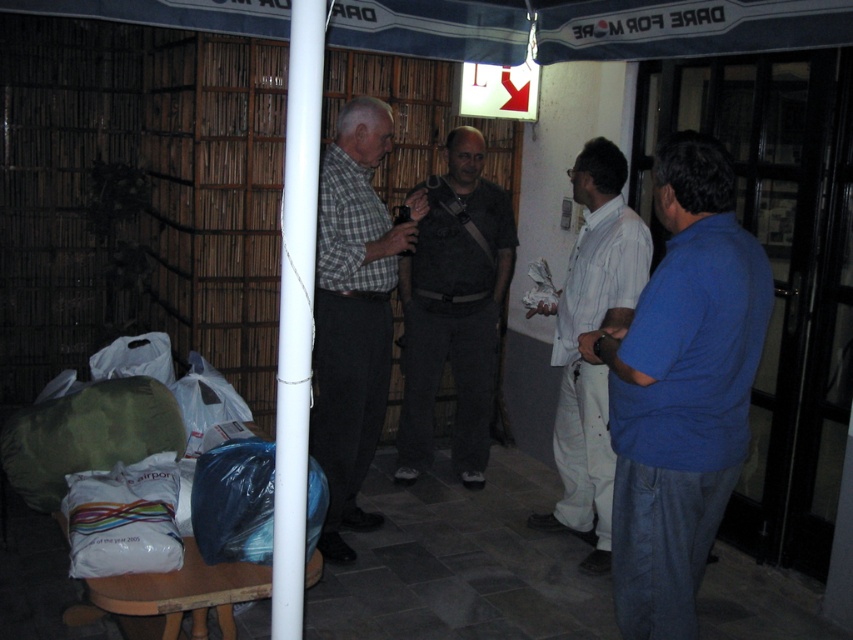
You are a photographer aiming to capture the blue cotton shirt at right without including the white pole in the foreground. Based on their positions, can you position yourself to the left or right of the group to achieve this?

To avoid including the white pole in the foreground, you should position yourself to the right of the group. The blue cotton shirt at right is located at point (682, 388), which suggests it is positioned to the right side of the frame, away from the pole. By moving to the right, you can frame the shot so the pole is excluded while still capturing the blue cotton shirt at right.

You are a photographer trying to capture a clear shot of both the blue cotton shirt at right and the white cotton shirt at center. Based on their positions, which one is closer to the camera?

The blue cotton shirt at right is positioned under the white cotton shirt at center, meaning it is closer to the camera.

Based on the photo, you are a photographer trying to capture a photo of the two men wearing the checkered fabric shirt at center and the white cotton shirt at center. Since the white pole in the foreground might block your view, can you position yourself so that both men are visible without the pole obstructing them?

The checkered fabric shirt at center is to the left of the white cotton shirt at center. Since the white pole is in the foreground and slightly obscuring part of the scene, positioning yourself to the right side of the pole would allow you to see both men as the checkered shirt is left and the white shirt is to the right, avoiding the obstruction.